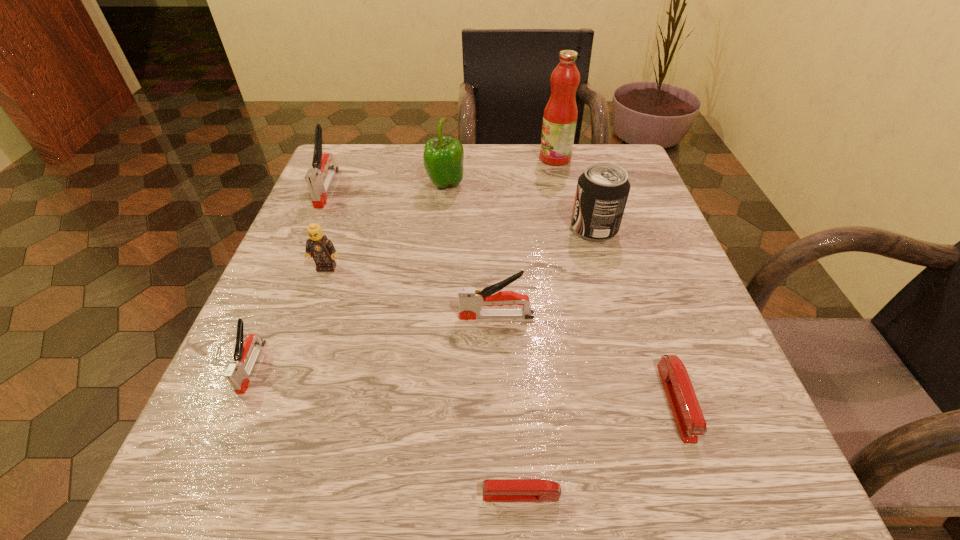
At what (x,y) coordinates should I click in order to perform the action: click on the tallest object. Please return your answer as a coordinate pair (x, y). This screenshot has height=540, width=960. Looking at the image, I should click on (560, 115).

Image resolution: width=960 pixels, height=540 pixels. Find the location of `pink fruit juice`. pink fruit juice is located at coordinates (560, 115).

Where is `the sixth object from right to left`? This screenshot has height=540, width=960. the sixth object from right to left is located at coordinates (443, 157).

Where is `green bell pepper`? green bell pepper is located at coordinates (443, 157).

At what (x,y) coordinates should I click in order to perform the action: click on the farthest stapler. Please return your answer as a coordinate pair (x, y). This screenshot has width=960, height=540. Looking at the image, I should click on (319, 190).

Identify the location of the farthest gray stapler. The height and width of the screenshot is (540, 960). (319, 190).

At what (x,y) coordinates should I click in order to perform the action: click on black soda can. Please return your answer as a coordinate pair (x, y). Image resolution: width=960 pixels, height=540 pixels. Looking at the image, I should click on (602, 191).

Find the location of a particular element. The height and width of the screenshot is (540, 960). the fourth farthest object is located at coordinates (602, 191).

Identify the location of the fourth shortest stapler. (471, 299).

This screenshot has height=540, width=960. In order to click on the second biggest gray stapler in this screenshot , I will do `click(471, 299)`.